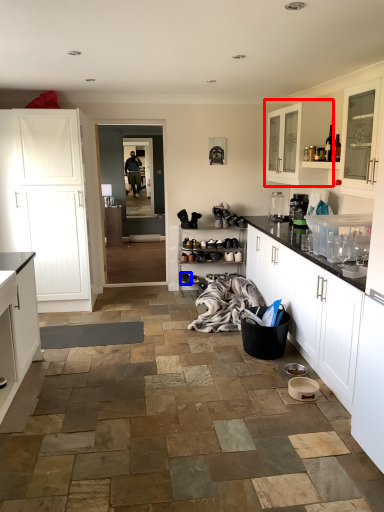
Question: Which object appears farthest to the camera in this image, cabinetry (highlighted by a red box) or footwear (highlighted by a blue box)?

Choices:
 (A) cabinetry
 (B) footwear

Answer: (B)